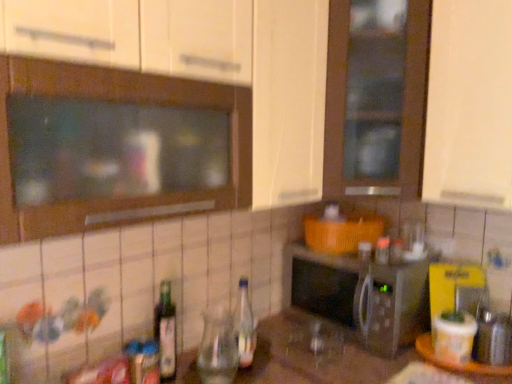
Question: Considering the positions of green glass bottle at lower left, arranged as the 1th bottle when viewed from the left, and clear glass bottle at center, the 2th bottle viewed from the left, in the image, is green glass bottle at lower left, arranged as the 1th bottle when viewed from the left, wider or thinner than clear glass bottle at center, the 2th bottle viewed from the left,?

Choices:
 (A) thin
 (B) wide

Answer: (A)

Question: From the image's perspective, is green glass bottle at lower left, arranged as the 1th bottle when viewed from the left, located above or below clear glass bottle at center, the 2th bottle viewed from the left?

Choices:
 (A) above
 (B) below

Answer: (B)

Question: Estimate the real-world distances between objects in this image. Which object is closer to the wooden tray at lower right?

Choices:
 (A) silver metallic microwave at center
 (B) green glass bottle at lower left, which is the second bottle from right to left
 (C) clear glass bottle at center, placed as the 1th bottle when sorted from right to left

Answer: (A)

Question: Based on their relative distances, which object is farther from the clear glass bottle at center, the 2th bottle viewed from the left?

Choices:
 (A) green glass bottle at lower left, arranged as the 1th bottle when viewed from the left
 (B) silver metallic microwave at center
 (C) wooden tray at lower right

Answer: (C)